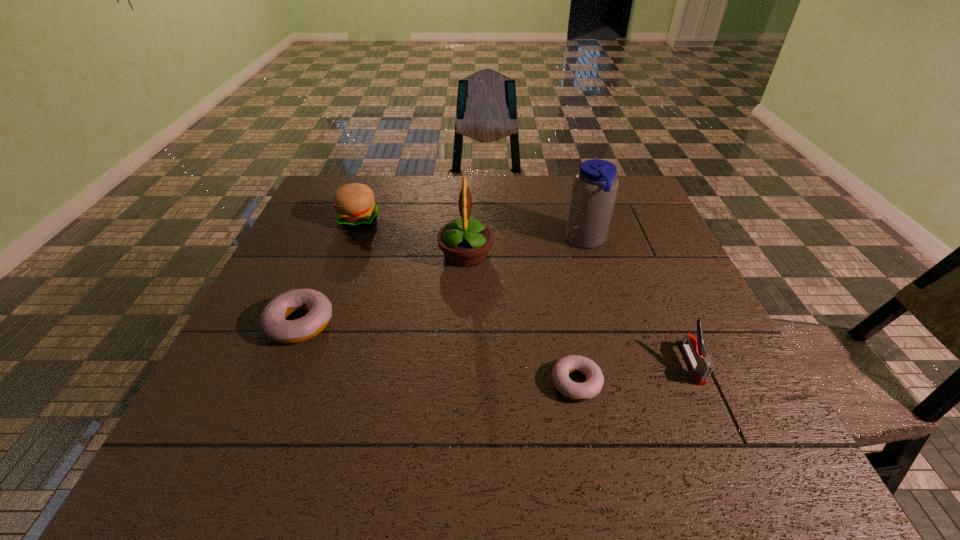
Find the location of a particular element. This screenshot has height=540, width=960. hamburger situated at the left edge is located at coordinates (355, 208).

Image resolution: width=960 pixels, height=540 pixels. Find the location of `object that is at the right edge`. object that is at the right edge is located at coordinates (702, 367).

Identify the location of object positioned at the far left corner. Image resolution: width=960 pixels, height=540 pixels. (355, 208).

Locate an element on the screen. The image size is (960, 540). object situated at the near right corner is located at coordinates (702, 367).

Image resolution: width=960 pixels, height=540 pixels. Identify the location of vacant space at the far edge. (383, 194).

At what (x,y) coordinates should I click in order to perform the action: click on vacant space at the near edge of the desktop. Please return your answer as a coordinate pair (x, y). This screenshot has width=960, height=540. Looking at the image, I should click on (561, 409).

In the image, there is a desktop. Identify the location of free region at the left edge. [x=300, y=238].

Where is `vacant space at the right edge of the desktop`? vacant space at the right edge of the desktop is located at coordinates (676, 354).

In the image, there is a desktop. Where is `free space at the near left corner`? Image resolution: width=960 pixels, height=540 pixels. free space at the near left corner is located at coordinates (214, 390).

In the image, there is a desktop. Identify the location of free space at the far right corner. (626, 179).